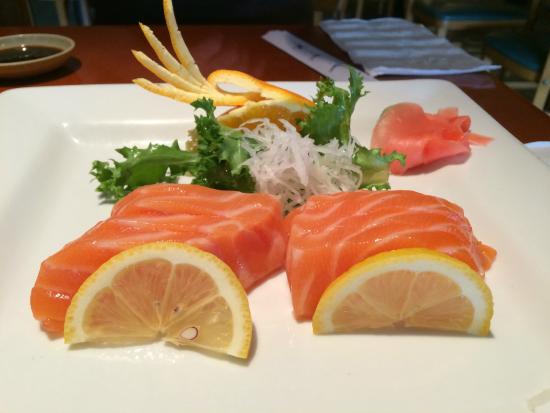
The image size is (550, 413). I want to click on napkin, so click(x=429, y=30).